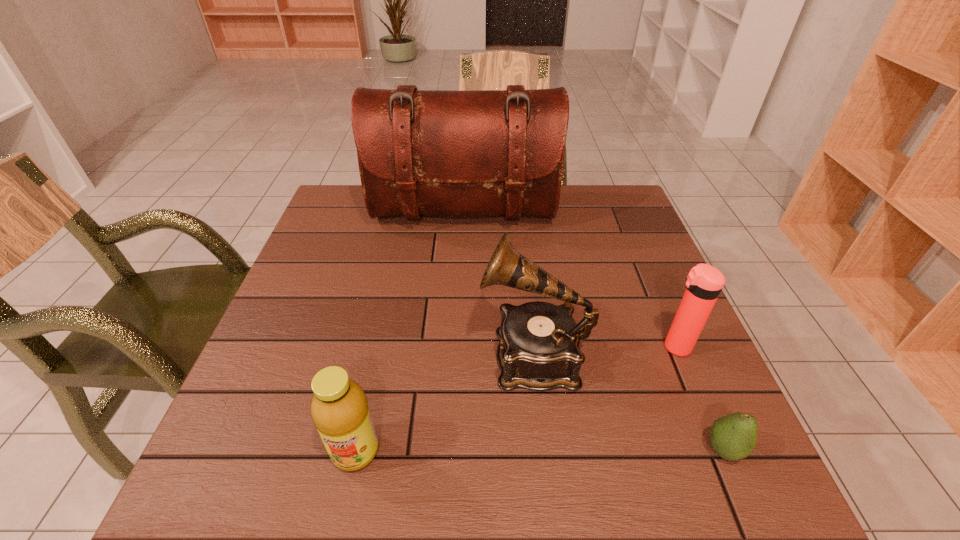
Locate an element on the screen. This screenshot has width=960, height=540. free region that satisfies the following two spatial constraints: 1. on the horn of the avocado; 2. on the right side of the second tallest object is located at coordinates (544, 450).

The image size is (960, 540). In order to click on blank area in the image that satisfies the following two spatial constraints: 1. on the front-facing side of the avocado; 2. on the right side of the farthest object in this screenshot , I will do `click(452, 450)`.

Locate an element on the screen. The height and width of the screenshot is (540, 960). free space in the image that satisfies the following two spatial constraints: 1. on the horn of the phonograph record; 2. on the front label of the fruit juice is located at coordinates (544, 451).

Locate an element on the screen. free space that satisfies the following two spatial constraints: 1. on the front-facing side of the thermos bottle; 2. on the left side of the tallest object is located at coordinates (457, 347).

Identify the location of free space that satisfies the following two spatial constraints: 1. on the front side of the thermos bottle; 2. on the horn of the fourth shortest object. Image resolution: width=960 pixels, height=540 pixels. (679, 355).